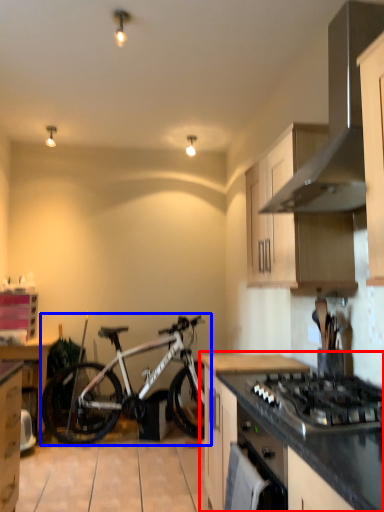
Question: Among these objects, which one is nearest to the camera, countertop (highlighted by a red box) or bicycle (highlighted by a blue box)?

Choices:
 (A) countertop
 (B) bicycle

Answer: (A)